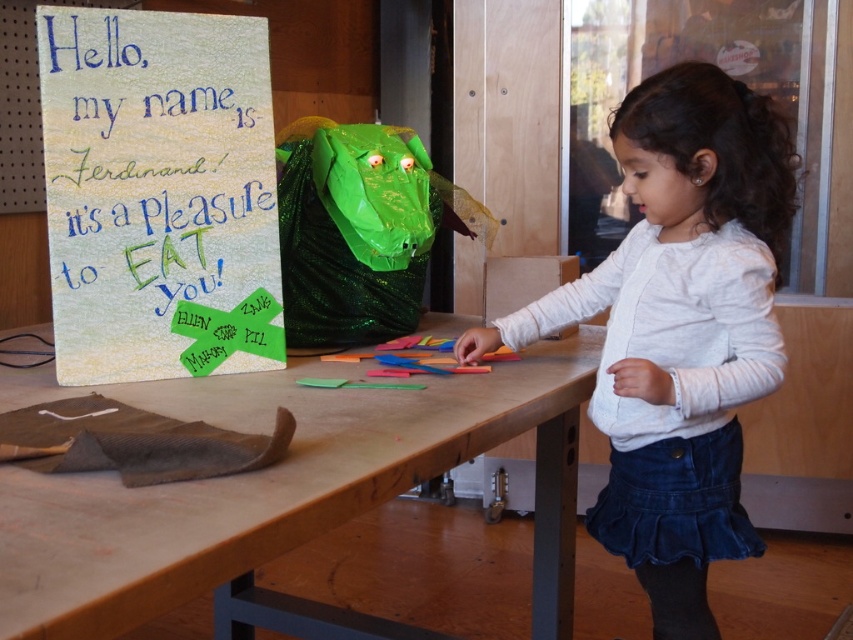
Looking at the scene described, where is the white soft sweater at center in relation to the textured paper sign at upper left?

The white soft sweater at center is to the right of the textured paper sign at upper left.

You are standing in front of the dragon sculpture and notice two points marked on the floor. The first point is at coordinates point(345,618) and the second at point(262,243). If you want to move closer to the dragon sculpture, which point should you step on?

You should step on point(262,243) because it is in front of the dragon sculpture, allowing you to move closer to it.